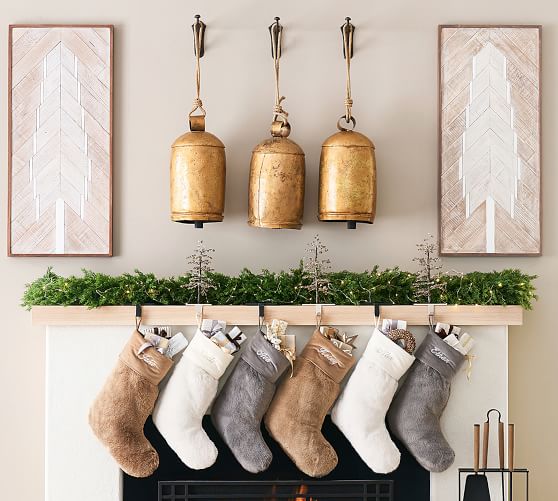
Image resolution: width=558 pixels, height=501 pixels. I want to click on mantel, so click(283, 315).